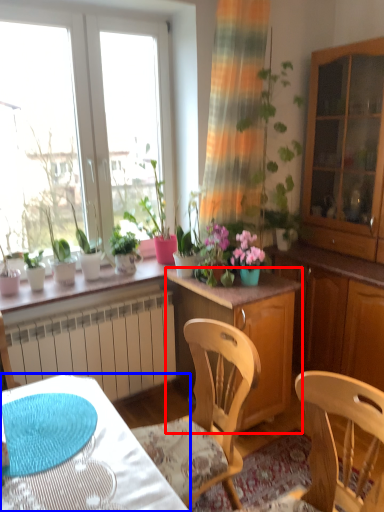
Question: Which point is closer to the camera, cabinetry (highlighted by a red box) or desk (highlighted by a blue box)?

Choices:
 (A) cabinetry
 (B) desk

Answer: (B)